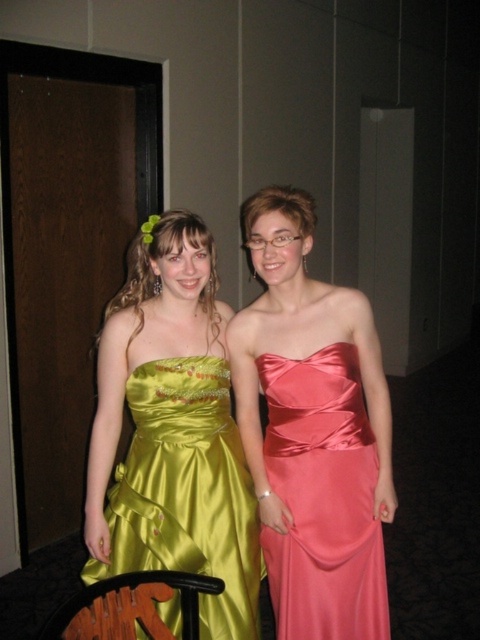
You are a photographer setting up for a group photo. You need to position the green satin dress at left and the satin pink dress at center so that both can fit comfortably side by side. Based on the scene description, which dress requires more horizontal space due to its width?

The green satin dress at left requires more horizontal space because its width is larger than the satin pink dress at center.

You are a photographer at a formal event and need to capture a closeup shot of both the green satin dress at left and the satin pink dress at center. The camera you are using has a maximum focus range of 20 centimeters. Can you fit both dresses in the frame without moving the camera?

The green satin dress at left and the satin pink dress at center are 21.18 centimeters apart. Since the distance between them exceeds the camera maximum focus range of 20 centimeters, you cannot fit both dresses in the frame without moving the camera.

You are at a formal event and need to determine which of the two points in the image is closer to you. The points are labeled as point (230, 440) and point (330, 561). Which point is closer to your vantage point?

Point (230, 440) is closer to the viewer than point (330, 561).